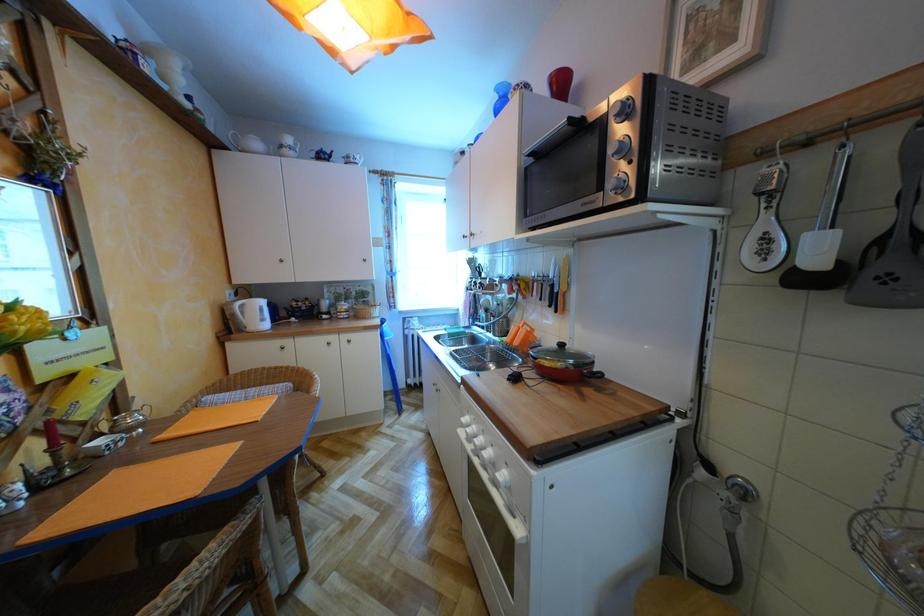
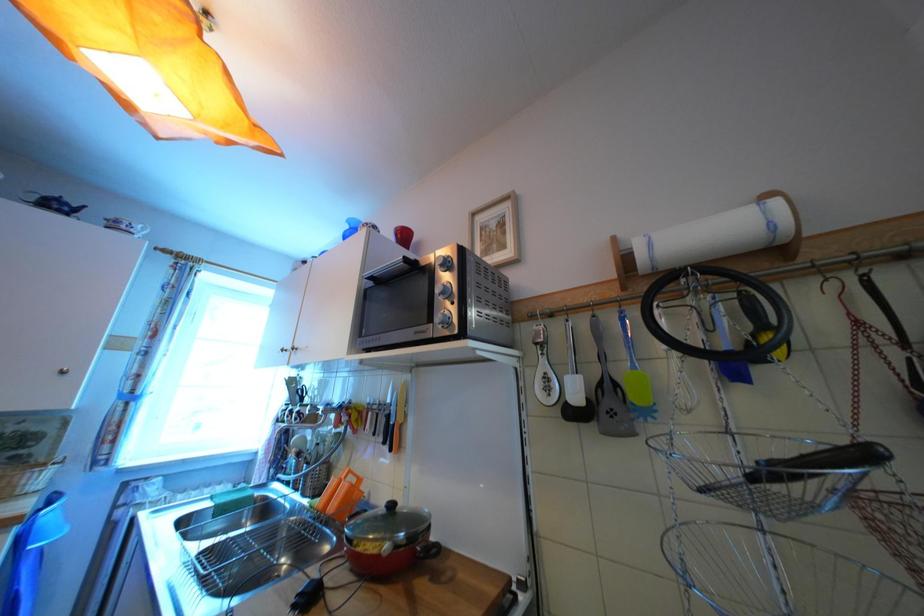
Based on the photo, the images are taken continuously from a first-person perspective. In which direction is your viewpoint rotating?

The rotation direction of the camera is right-up.